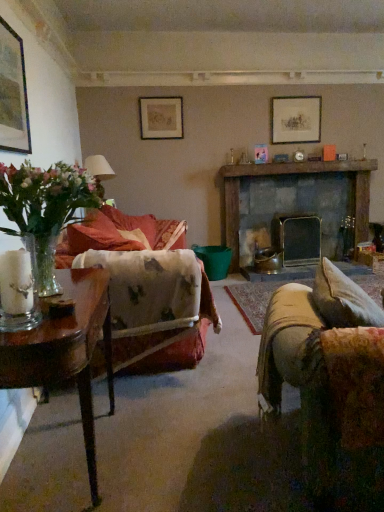
Question: Is dark gray stone fireplace at center bigger or smaller than matte silver picture frame at upper center, acting as the 3th picture frame starting from the front?

Choices:
 (A) big
 (B) small

Answer: (A)

Question: From the image's perspective, is dark gray stone fireplace at center located above or below matte silver picture frame at upper center, marked as the 3th picture frame in a left-to-right arrangement?

Choices:
 (A) below
 (B) above

Answer: (A)

Question: Which is nearer to the dark gray stone fireplace at center?

Choices:
 (A) matte black picture frame at upper left, which ranks as the 1th picture frame in left-to-right order
 (B) velvet floral pillow at center
 (C) wooden table at left
 (D) matte gold picture frame at upper center, the second picture frame positioned from the back
 (E) clear glass vase at left

Answer: (D)

Question: Based on their relative distances, which object is farther from the clear glass vase at left?

Choices:
 (A) velvet floral-patterned couch at left
 (B) wooden table at left
 (C) matte silver picture frame at upper center, which is the 1th picture frame in right-to-left order
 (D) velvet floral pillow at center
 (E) matte black picture frame at upper left, which ranks as the 1th picture frame in left-to-right order

Answer: (C)